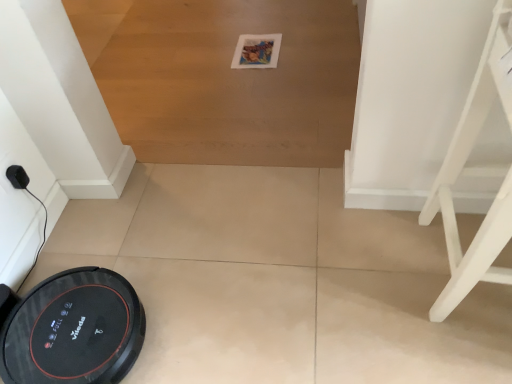
What do you see at coordinates (475, 175) in the screenshot? I see `white wood chair at right` at bounding box center [475, 175].

In order to click on white wood chair at right in this screenshot , I will do `click(475, 175)`.

Measure the distance between point (x=461, y=293) and camera.

The distance of point (x=461, y=293) from camera is 93.50 centimeters.

Image resolution: width=512 pixels, height=384 pixels. I want to click on white wood chair at right, so tap(475, 175).